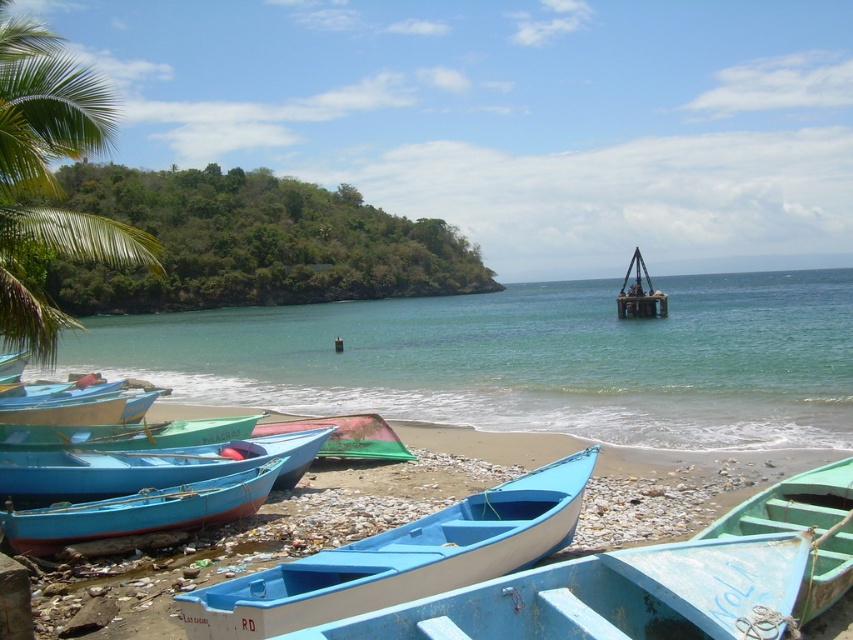
Does point (637, 595) lie in front of point (347, 413)?

That is True.

Is light blue wooden canoe at center bigger than green matte canoe at center?

Actually, light blue wooden canoe at center might be smaller than green matte canoe at center.

Between point (444, 608) and point (386, 429), which one is positioned behind?

Positioned behind is point (386, 429).

Locate an element on the screen. The width and height of the screenshot is (853, 640). light blue wooden canoe at center is located at coordinates (611, 596).

Measure the distance between clear blue water at center and camera.

clear blue water at center and camera are 13.67 meters apart from each other.

Does clear blue water at center appear over green matte canoe at center?

Yes.

Who is more forward, (140, 340) or (260, 428)?

Positioned in front is point (260, 428).

Find the location of a particular element. This screenshot has width=853, height=640. clear blue water at center is located at coordinates (525, 358).

Does point (730, 280) come behind point (22, 93)?

Yes, point (730, 280) is farther from viewer.

Does clear blue water at center appear on the left side of green leafy palm tree at upper left?

In fact, clear blue water at center is to the right of green leafy palm tree at upper left.

Is point (790, 387) in front of point (4, 291)?

No, (790, 387) is behind (4, 291).

Where is `clear blue water at center`? clear blue water at center is located at coordinates (525, 358).